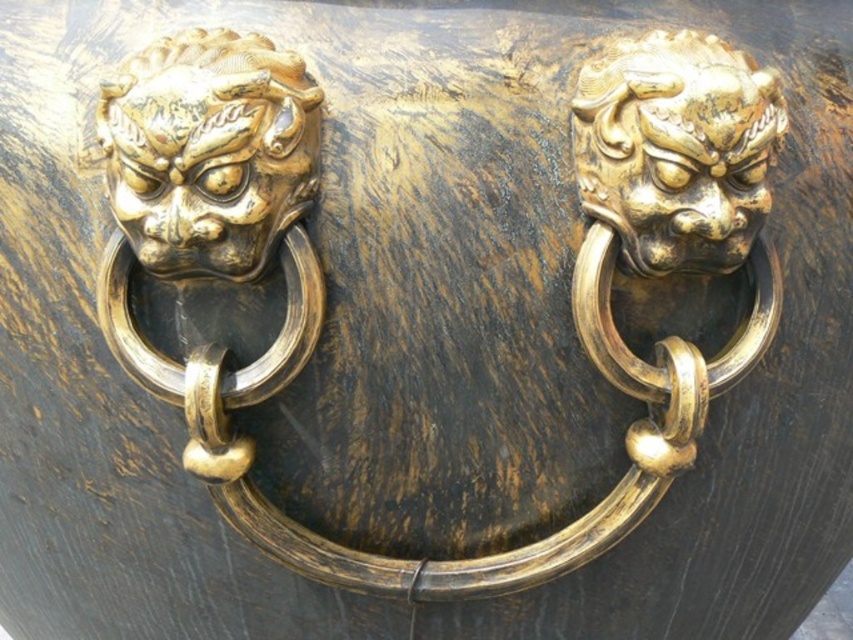
Question: Is gold polished lion head at left to the right of gold polished lion head at upper right from the viewer's perspective?

Choices:
 (A) yes
 (B) no

Answer: (B)

Question: Does gold polished lion head at left appear on the right side of gold polished lion head at upper right?

Choices:
 (A) no
 (B) yes

Answer: (A)

Question: Which object is farther from the camera taking this photo?

Choices:
 (A) gold polished lion head at upper right
 (B) gold polished lion head at left

Answer: (A)

Question: Does gold polished lion head at left lie in front of gold polished lion head at upper right?

Choices:
 (A) no
 (B) yes

Answer: (B)